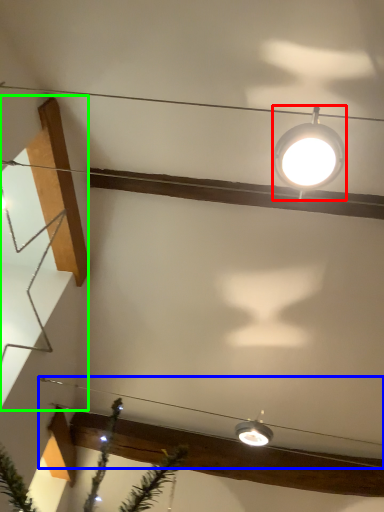
Question: Considering the real-world distances, which object is closest to lamp (highlighted by a red box)? wire (highlighted by a blue box) or stairwell (highlighted by a green box).

Choices:
 (A) wire
 (B) stairwell

Answer: (B)